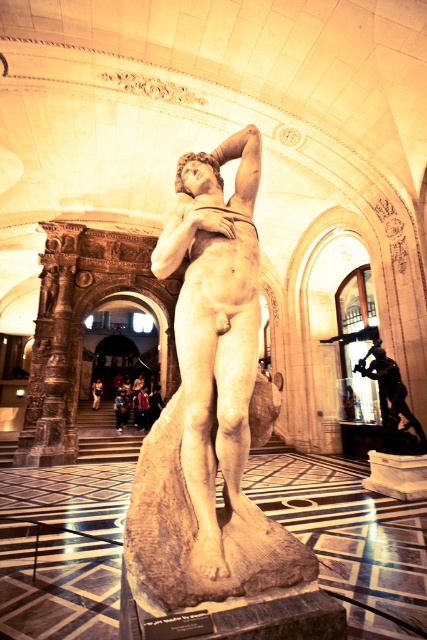
Question: Is white marble statue at center to the right of shiny bronze statue at center from the viewer's perspective?

Choices:
 (A) yes
 (B) no

Answer: (B)

Question: Which object is closer to the camera taking this photo?

Choices:
 (A) white marble statue at center
 (B) shiny bronze statue at center

Answer: (A)

Question: Is white marble statue at center positioned in front of shiny bronze statue at center?

Choices:
 (A) no
 (B) yes

Answer: (B)

Question: Which of the following is the closest to the observer?

Choices:
 (A) shiny bronze statue at center
 (B) white marble statue at center

Answer: (B)

Question: Does white marble statue at center appear over shiny bronze statue at center?

Choices:
 (A) yes
 (B) no

Answer: (A)